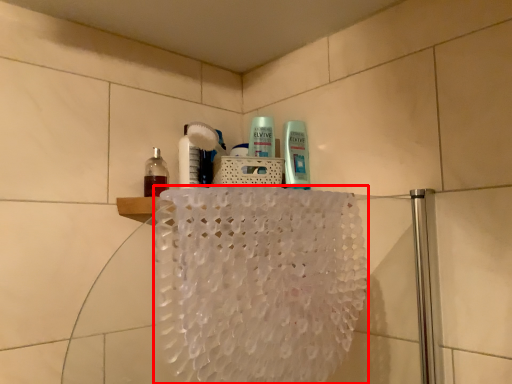
Question: Where is bath towel (annotated by the red box) located in relation to bottle in the image?

Choices:
 (A) left
 (B) right

Answer: (B)